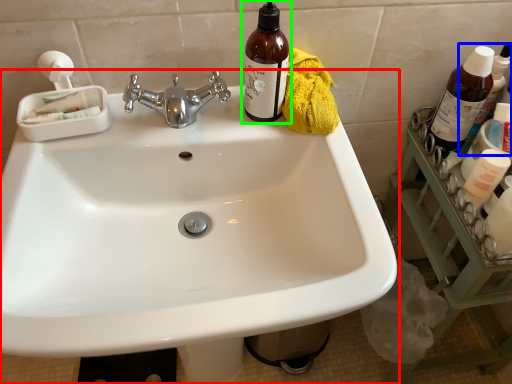
Question: Estimate the real-world distances between objects in this image. Which object is closer to sink (highlighted by a red box), bottle (highlighted by a blue box) or bottle (highlighted by a green box)?

Choices:
 (A) bottle
 (B) bottle

Answer: (B)